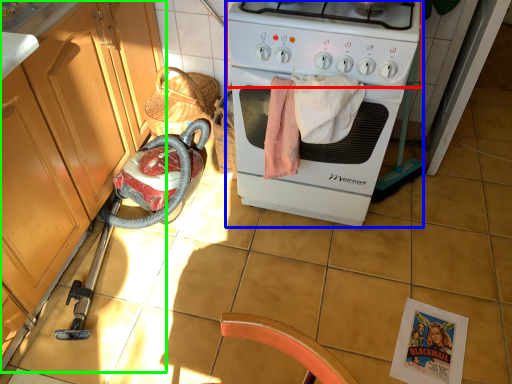
Question: Which object is positioned farthest from gas stove (highlighted by a red box)? Select from home appliance (highlighted by a blue box) and cabinetry (highlighted by a green box).

Choices:
 (A) home appliance
 (B) cabinetry

Answer: (B)